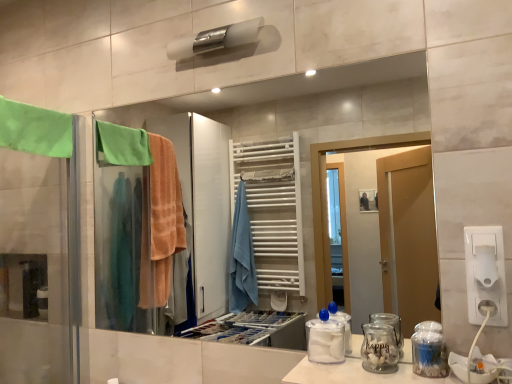
Where is `free space above transparent glass jar at lower right (from a real-world perspective)`? free space above transparent glass jar at lower right (from a real-world perspective) is located at coordinates (381, 368).